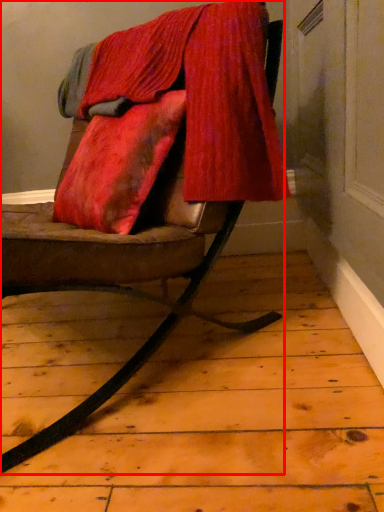
Question: From the image's perspective, where is chair (annotated by the red box) located relative to velvet?

Choices:
 (A) below
 (B) above

Answer: (A)